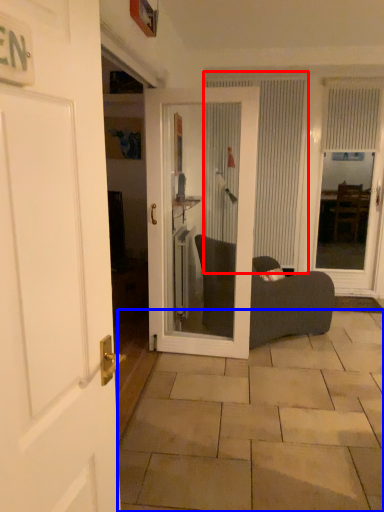
Question: Which point is further to the camera, curtain (highlighted by a red box) or tile (highlighted by a blue box)?

Choices:
 (A) curtain
 (B) tile

Answer: (A)